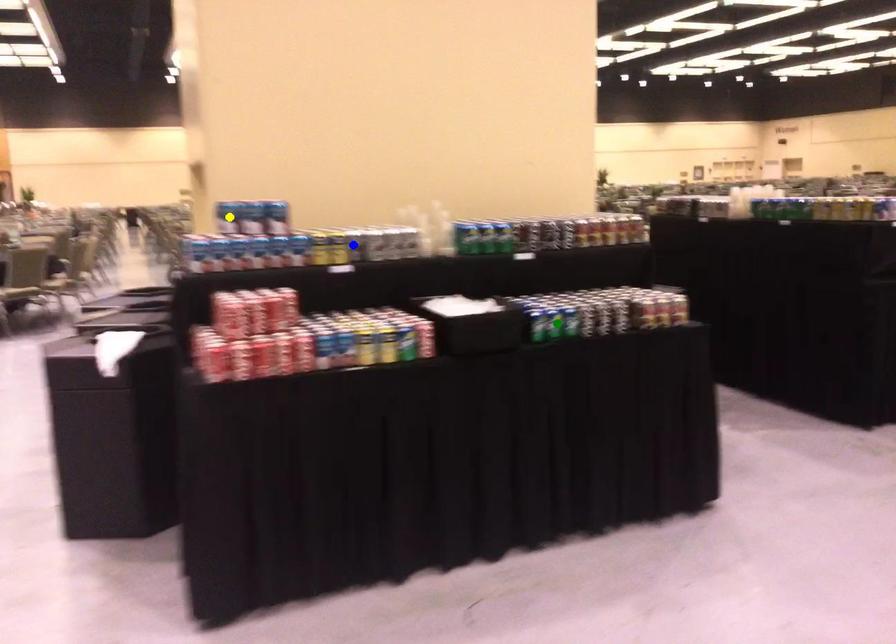
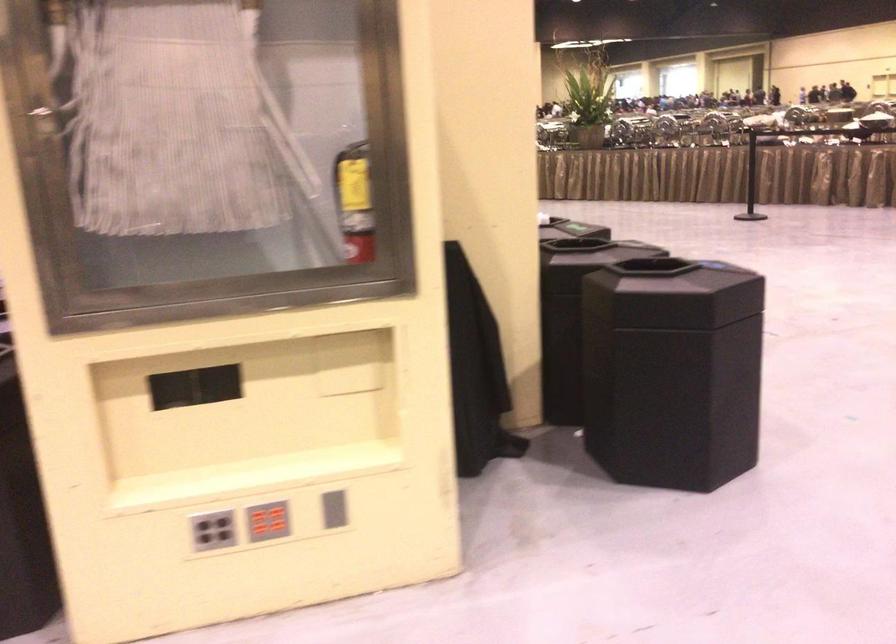
I am providing you with two images of the same scene from different viewpoints. Three points are marked in image1. Which point corresponds to a part or object that is occluded in image2?In image1, three points are marked. Which of them correspond to a part or object that is occluded in image2?Among the three points shown in image1, which one corresponds to a part or object that is no longer visible due to occlusion in image2?

Invisible in image2: yellow point, green point, blue point.